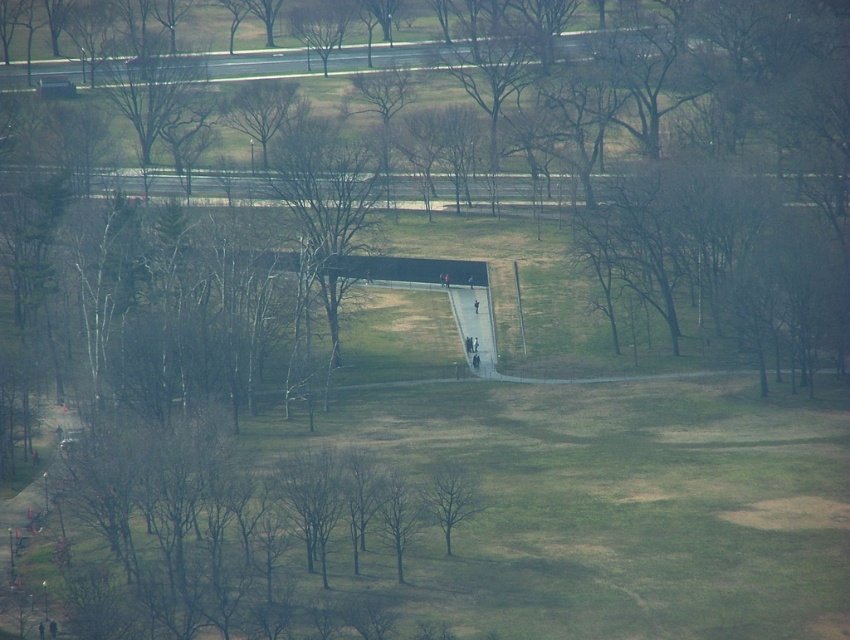
You are standing at the point labeled point [262,109] in the park. What object or feature is located at that exact coordinate?

The point [262,109] corresponds to bare branches at center.

You are a park visitor holding a 1.2 meter wide kite. You want to fly it between the bare branches at center and the green leafy tree at center. Can you fit the kite between them without touching either?

The bare branches at center might be wider than green leafy tree at center, so the distance between them may be insufficient to fit a 1.2 meter wide kite without touching either. Check the actual spacing before flying.